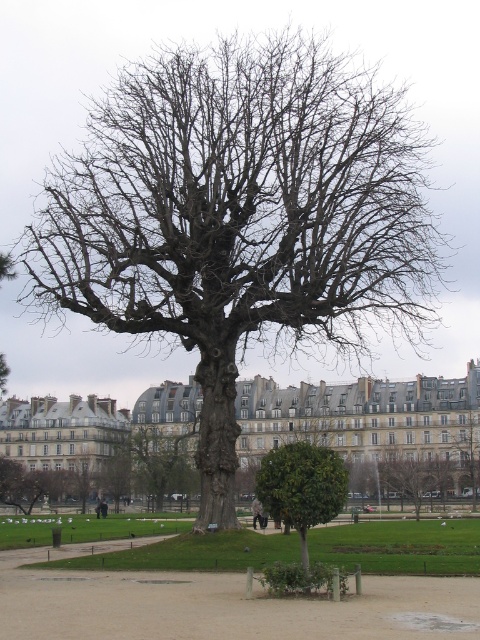
Looking at this image, you are standing in the park and see the green grass at center and the bare wood tree at center. Which object is positioned to the left of the other?

The green grass at center is to the left of the bare wood tree at center.

You are standing in the park and want to take a photo of the green leafy tree at center. To do this, you need to position yourself so that the tree is centered in your camera viewfinder. Given that the tree is located at coordinates point 0.761, 0.629, where should you stand relative to the tree to ensure it is perfectly centered?

The green leafy tree at center is already positioned at point (301,486), so you should stand directly in front of it at the coordinates that align with its central point to ensure it remains centered in your camera viewfinder.

Looking at this image, you are standing in the park and see both the green leafy tree at center and the bare wood tree at center. Which tree is located to the right when facing the scene?

The bare wood tree at center is located to the right since the green leafy tree at center is positioned on its left side.